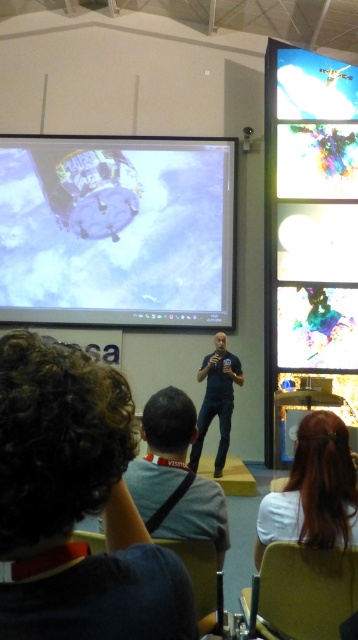
Based on the photo, can you confirm if shiny metallic display at right is smaller than smooth brown hair at lower right?

No, shiny metallic display at right is not smaller than smooth brown hair at lower right.

Is point (269, 205) behind point (340, 500)?

Yes.

This screenshot has width=358, height=640. I want to click on shiny metallic display at right, so click(310, 225).

Looking at this image, which is more to the right, shiny metallic display at right or blue denim jeans at center?

Positioned to the right is shiny metallic display at right.

Does shiny metallic display at right come behind blue denim jeans at center?

Yes, shiny metallic display at right is further from the viewer.

Find the location of a particular element. The width and height of the screenshot is (358, 640). shiny metallic display at right is located at coordinates (310, 225).

Can you confirm if metallic spacecraft at upper left is thinner than transparent plastic screen at upper right?

Incorrect, metallic spacecraft at upper left's width is not less than transparent plastic screen at upper right's.

Can you confirm if metallic spacecraft at upper left is positioned to the left of transparent plastic screen at upper right?

Yes, metallic spacecraft at upper left is to the left of transparent plastic screen at upper right.

What are the coordinates of `metallic spacecraft at upper left` in the screenshot? It's located at (117, 230).

Locate an element on the screen. This screenshot has height=640, width=358. metallic spacecraft at upper left is located at coordinates (117, 230).